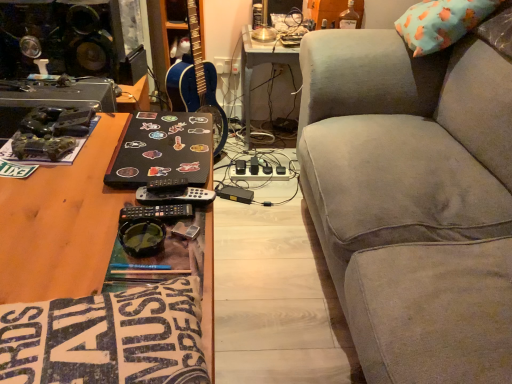
This screenshot has height=384, width=512. What do you see at coordinates (162, 150) in the screenshot? I see `sticker-covered black laptop at center` at bounding box center [162, 150].

At what (x,y) coordinates should I click in order to perform the action: click on gray fabric couch at right. Please return your answer as a coordinate pair (x, y). Looking at the image, I should click on (413, 200).

Describe the element at coordinates (258, 64) in the screenshot. I see `white plastic table at center` at that location.

In order to click on sticker-covered black laptop at center in this screenshot , I will do `click(162, 150)`.

Can you confirm if green rubber goggles at center is wider than gray fabric couch at right?

No.

From a real-world perspective, is green rubber goggles at center over gray fabric couch at right?

Yes, from a real-world perspective, green rubber goggles at center is over gray fabric couch at right

Is green rubber goggles at center smaller than gray fabric couch at right?

Yes.

Could you tell me if green rubber goggles at center is turned towards black plastic remote at center?

No, green rubber goggles at center is not aimed at black plastic remote at center.

From a real-world perspective, is green rubber goggles at center over black plastic remote at center?

Yes.

From the image's perspective, between green rubber goggles at center and black plastic remote at center, which one is located above?

black plastic remote at center, from the image's perspective.

Considering the relative positions of green rubber goggles at center and black plastic remote at center in the image provided, is green rubber goggles at center to the left of black plastic remote at center from the viewer's perspective?

Yes, green rubber goggles at center is to the left of black plastic remote at center.

Which object is further away from the camera taking this photo, gray fabric couch at right or black plastic remote at center?

black plastic remote at center.

Between gray fabric couch at right and black plastic remote at center, which one appears on the right side from the viewer's perspective?

Positioned to the right is gray fabric couch at right.

From the image's perspective, is gray fabric couch at right on black plastic remote at center?

Correct, gray fabric couch at right appears higher than black plastic remote at center in the image.

Is gray fabric couch at right facing away from black plastic remote at center?

No, gray fabric couch at right is not facing the opposite direction of black plastic remote at center.

Would you say black plastic remote at center is inside or outside white plastic table at center?

black plastic remote at center is spatially situated outside white plastic table at center.

Does black plastic remote at center have a greater height compared to white plastic table at center?

Incorrect, the height of black plastic remote at center is not larger of that of white plastic table at center.

Is black plastic remote at center wider than white plastic table at center?

Incorrect, the width of black plastic remote at center does not surpass that of white plastic table at center.

From the image's perspective, is black plastic remote at center beneath white plastic table at center?

Indeed, from the image's perspective, black plastic remote at center is shown beneath white plastic table at center.

From the image's perspective, is blue glossy guitar at center located above or below black plastic remote at center?

Clearly, from the image's perspective, blue glossy guitar at center is above black plastic remote at center.

In the scene shown: Is blue glossy guitar at center positioned beyond the bounds of black plastic remote at center?

blue glossy guitar at center is positioned outside black plastic remote at center.

Is blue glossy guitar at center taller than black plastic remote at center?

Indeed, blue glossy guitar at center has a greater height compared to black plastic remote at center.

This screenshot has height=384, width=512. I want to click on remote lying below the blue glossy guitar at center (from the image's perspective), so click(x=156, y=212).

Looking at their sizes, would you say white plastic table at center is wider or thinner than green rubber goggles at center?

Clearly, white plastic table at center has more width compared to green rubber goggles at center.

How different are the orientations of white plastic table at center and green rubber goggles at center in degrees?

white plastic table at center and green rubber goggles at center are facing 84 degrees away from each other.

From a real-world perspective, who is located higher, white plastic table at center or green rubber goggles at center?

green rubber goggles at center is physically above.

Are white plastic table at center and green rubber goggles at center located far from each other?

Yes.

Which of these two, sticker-covered black laptop at center or wooden desk at lower left, is thinner?

Thinner between the two is sticker-covered black laptop at center.

Which is more to the right, sticker-covered black laptop at center or wooden desk at lower left?

wooden desk at lower left.

What's the angular difference between sticker-covered black laptop at center and wooden desk at lower left's facing directions?

They differ by 6.44 degrees in their facing directions.

Is sticker-covered black laptop at center shorter than wooden desk at lower left?

Correct, sticker-covered black laptop at center is not as tall as wooden desk at lower left.

Image resolution: width=512 pixels, height=384 pixels. I want to click on goggles located behind the gray fabric couch at right, so click(142, 237).

The width and height of the screenshot is (512, 384). In order to click on goggles positioned vertically above the black plastic remote at center (from a real-world perspective) in this screenshot , I will do `click(142, 237)`.

Considering their positions, is green rubber goggles at center positioned further to black plastic remote at center than sticker-covered black laptop at center?

Based on the image, sticker-covered black laptop at center appears to be further to black plastic remote at center.

When comparing their distances from wooden desk at lower left, does black plastic remote at center or green rubber goggles at center seem closer?

black plastic remote at center.

When comparing their distances from wooden desk at lower left, does blue glossy guitar at center or sticker-covered black laptop at center seem closer?

sticker-covered black laptop at center.

Which object lies nearer to the anchor point sticker-covered black laptop at center, white plastic table at center or blue glossy guitar at center?

blue glossy guitar at center is positioned closer to the anchor sticker-covered black laptop at center.

Looking at the image, which one is located further to blue glossy guitar at center, wooden desk at lower left or black plastic remote at center?

black plastic remote at center is positioned further to the anchor blue glossy guitar at center.

Estimate the real-world distances between objects in this image. Which object is closer to sticker-covered black laptop at center, gray fabric couch at right or wooden desk at lower left?

The object closer to sticker-covered black laptop at center is wooden desk at lower left.

Which object lies nearer to the anchor point green rubber goggles at center, blue glossy guitar at center or wooden desk at lower left?

wooden desk at lower left is positioned closer to the anchor green rubber goggles at center.

Considering their positions, is white plastic table at center positioned further to black plastic remote at center than blue glossy guitar at center?

Among the two, white plastic table at center is located further to black plastic remote at center.

Where is `desk positioned between gray fabric couch at right and blue glossy guitar at center from near to far`? desk positioned between gray fabric couch at right and blue glossy guitar at center from near to far is located at coordinates (61, 223).

Find the location of a particular element. This screenshot has width=512, height=384. goggles between gray fabric couch at right and blue glossy guitar at center in the front-back direction is located at coordinates (142, 237).

This screenshot has width=512, height=384. What are the coordinates of `goggles between wooden desk at lower left and sticker-covered black laptop at center along the z-axis` in the screenshot? It's located at (142, 237).

In order to click on remote between green rubber goggles at center and blue glossy guitar at center along the z-axis in this screenshot , I will do `click(156, 212)`.